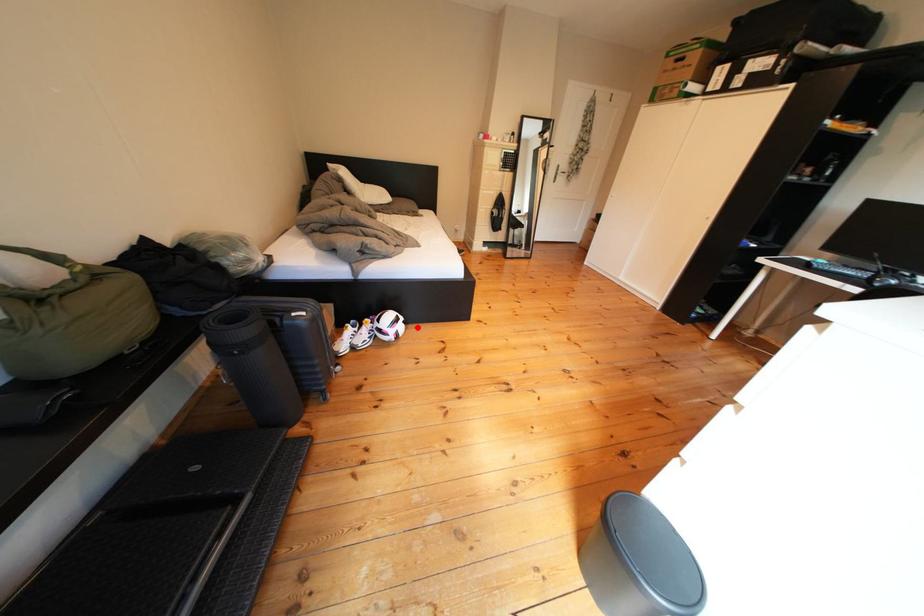
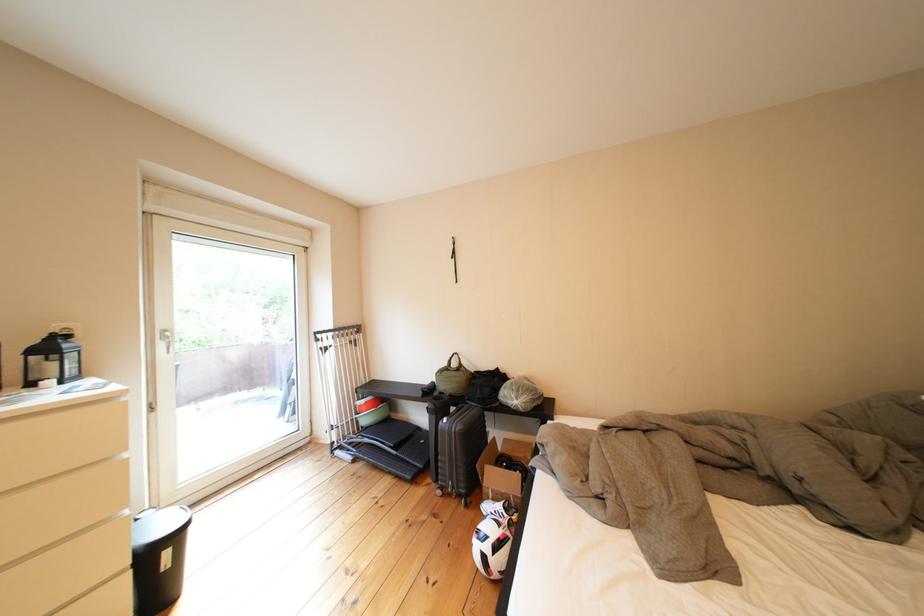
Question: I am providing you with two images of the same scene from different viewpoints. Given a red point in image1, look at the same physical point in image2. Is it:

Choices:
 (A) Closer to the viewpoint
 (B) Farther from the viewpoint

Answer: (B)